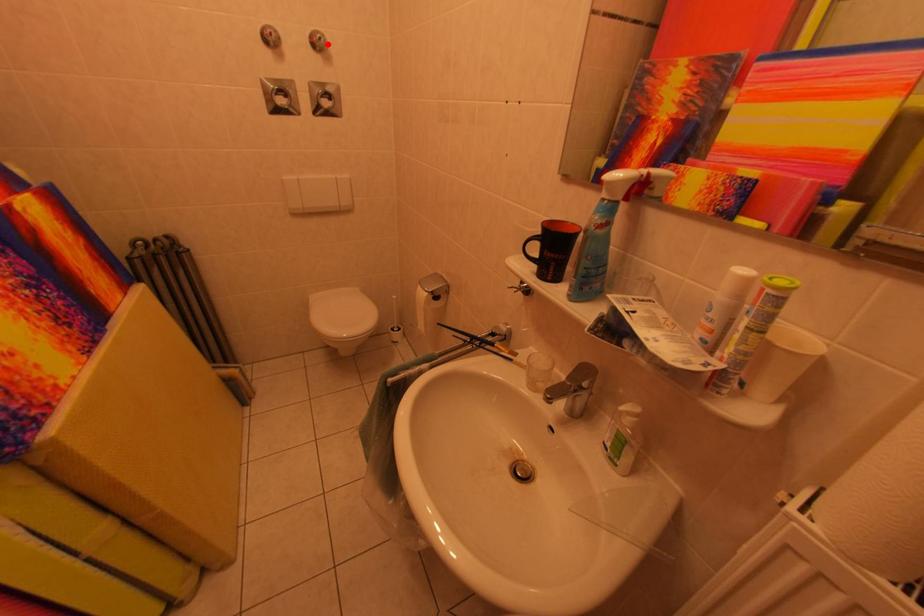
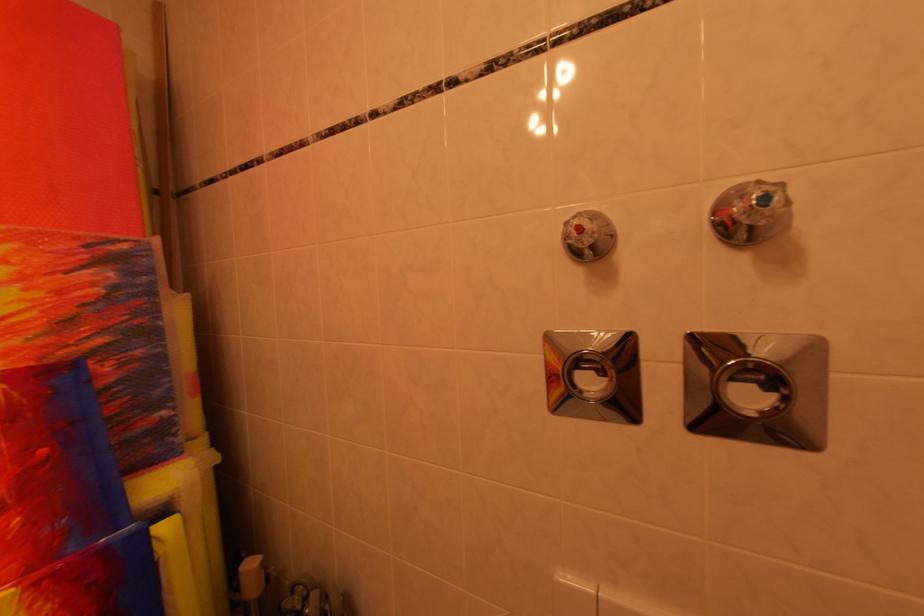
Question: I am providing you with two images of the same scene from different viewpoints. A red point is shown in image1. For the corresponding object point in image2, is it positioned nearer or farther from the camera?

Choices:
 (A) Nearer
 (B) Farther

Answer: (A)